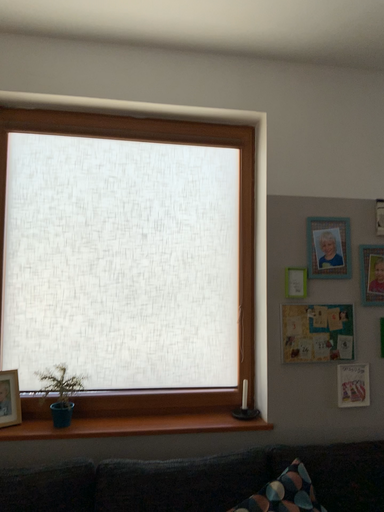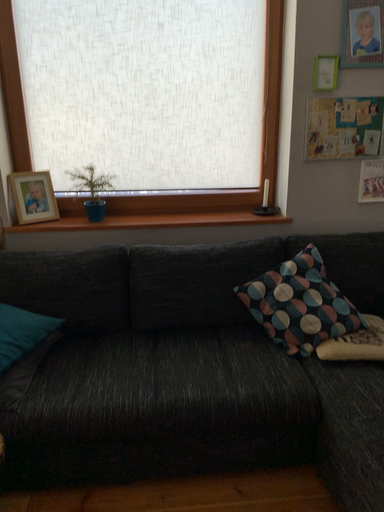
Question: How did the camera likely rotate when shooting the video?

Choices:
 (A) rotated upward
 (B) rotated downward

Answer: (B)